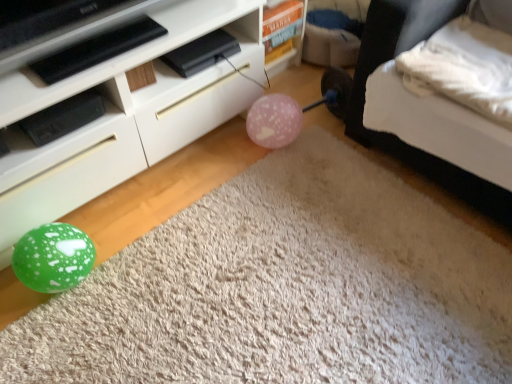
The image size is (512, 384). What do you see at coordinates (394, 135) in the screenshot?
I see `white soft bed at lower right` at bounding box center [394, 135].

Measure the distance between white soft pillow at upper right and camera.

white soft pillow at upper right and camera are 1.22 meters apart.

This screenshot has height=384, width=512. What are the coordinates of `pink matte balloon at center` in the screenshot? It's located at (274, 121).

This screenshot has width=512, height=384. I want to click on white soft bed at lower right, so click(x=394, y=135).

From a real-world perspective, between pink matte balloon at center and white soft pillow at upper right, who is vertically lower?

pink matte balloon at center is physically lower.

Identify the location of balloon behind the white soft pillow at upper right. (274, 121).

Is pink matte balloon at center positioned beyond the bounds of white soft pillow at upper right?

pink matte balloon at center is positioned outside white soft pillow at upper right.

Based on their sizes in the image, would you say pink matte balloon at center is bigger or smaller than white soft pillow at upper right?

In the image, pink matte balloon at center appears to be smaller than white soft pillow at upper right.

Which of these two, green glossy balloon at lower left or white glossy cabinet at lower left, stands taller?

Standing taller between the two is white glossy cabinet at lower left.

From a real-world perspective, which is physically below, green glossy balloon at lower left or white glossy cabinet at lower left?

green glossy balloon at lower left is physically lower.

Find the location of a particular element. This screenshot has width=512, height=384. furniture behind the green glossy balloon at lower left is located at coordinates (123, 116).

Is green glossy balloon at lower left oriented towards white glossy cabinet at lower left?

No, green glossy balloon at lower left does not turn towards white glossy cabinet at lower left.

From the image's perspective, between white soft bed at lower right and white soft pillow at upper right, who is located below?

white soft pillow at upper right, from the image's perspective.

Is white soft bed at lower right taller than white soft pillow at upper right?

Yes.

Which is more to the left, white soft bed at lower right or white soft pillow at upper right?

white soft pillow at upper right is more to the left.

Identify the location of pillow that is behind the green glossy balloon at lower left. The width and height of the screenshot is (512, 384). (464, 68).

From the image's perspective, is green glossy balloon at lower left located beneath white soft pillow at upper right?

Indeed, from the image's perspective, green glossy balloon at lower left is shown beneath white soft pillow at upper right.

Is green glossy balloon at lower left at the left side of white soft pillow at upper right?

Yes.

Which point is more forward, [295,157] or [486,50]?

The point [486,50] is more forward.

Are white soft pillow at upper right and green glossy balloon at lower left making contact?

No, white soft pillow at upper right is not with green glossy balloon at lower left.

From the picture: Considering the relative sizes of white soft pillow at upper right and green glossy balloon at lower left in the image provided, is white soft pillow at upper right shorter than green glossy balloon at lower left?

No, white soft pillow at upper right is not shorter than green glossy balloon at lower left.

Is white soft pillow at upper right at the left side of green glossy balloon at lower left?

No, white soft pillow at upper right is not to the left of green glossy balloon at lower left.

Considering the relative positions of white soft pillow at upper right and green glossy balloon at lower left in the image provided, is white soft pillow at upper right behind green glossy balloon at lower left?

Yes, white soft pillow at upper right is behind green glossy balloon at lower left.

Which of these two, white soft pillow at upper right or white soft bed at lower right, is smaller?

white soft pillow at upper right.

Between white soft pillow at upper right and white soft bed at lower right, which one has more height?

white soft bed at lower right.

Is white soft pillow at upper right further to camera compared to white soft bed at lower right?

That is True.

Which is closer, (449, 60) or (386, 20)?

Point (449, 60)

Which is behind, point (436, 355) or point (288, 100)?

The point (288, 100) is behind.

Considering the positions of objects green glossy balloon at lower left and pink matte balloon at center in the image provided, who is in front, green glossy balloon at lower left or pink matte balloon at center?

Positioned in front is green glossy balloon at lower left.

Is green glossy balloon at lower left shorter than pink matte balloon at center?

Correct, green glossy balloon at lower left is not as tall as pink matte balloon at center.

From a real-world perspective, between green glossy balloon at lower left and pink matte balloon at center, who is vertically higher?

In real-world perspective, pink matte balloon at center is above.

Locate an element on the screen. pillow in front of the pink matte balloon at center is located at coordinates (464, 68).

Where is `plain located on the right of white glossy cabinet at lower left`? The width and height of the screenshot is (512, 384). plain located on the right of white glossy cabinet at lower left is located at coordinates [x=285, y=289].

From the image, which object appears to be nearer to white soft pillow at upper right, white glossy cabinet at lower left or white soft bed at lower right?

Among the two, white soft bed at lower right is located nearer to white soft pillow at upper right.

Based on the photo, when comparing their distances from green glossy balloon at lower left, does white soft pillow at upper right or white soft bed at lower right seem closer?

Among the two, white soft bed at lower right is located nearer to green glossy balloon at lower left.

Considering their positions, is white soft bed at lower right positioned closer to white glossy cabinet at lower left than green glossy balloon at lower left?

green glossy balloon at lower left is closer to white glossy cabinet at lower left.

Based on their spatial positions, is green glossy balloon at lower left or white glossy cabinet at lower left further from white soft bed at lower right?

Among the two, white glossy cabinet at lower left is located further to white soft bed at lower right.

Looking at the image, which one is located further to white soft pillow at upper right, white soft bed at lower right or pink matte balloon at center?

pink matte balloon at center is further to white soft pillow at upper right.

From the image, which object appears to be nearer to white glossy cabinet at lower left, white soft bed at lower right or pink matte balloon at center?

Among the two, pink matte balloon at center is located nearer to white glossy cabinet at lower left.

Looking at the image, which one is located further to white glossy cabinet at lower left, white soft pillow at upper right or pink matte balloon at center?

white soft pillow at upper right is further to white glossy cabinet at lower left.

Estimate the real-world distances between objects in this image. Which object is closer to white glossy cabinet at lower left, pink matte balloon at center or green glossy balloon at lower left?

pink matte balloon at center.

The height and width of the screenshot is (384, 512). I want to click on pillow between white soft bed at lower right and green glossy balloon at lower left from top to bottom, so click(x=464, y=68).

This screenshot has height=384, width=512. I want to click on pillow situated between white glossy cabinet at lower left and white soft bed at lower right from left to right, so click(464, 68).

This screenshot has height=384, width=512. I want to click on plain between white glossy cabinet at lower left and white soft bed at lower right in the horizontal direction, so click(285, 289).

This screenshot has height=384, width=512. I want to click on plain located between pink matte balloon at center and white soft bed at lower right in the left-right direction, so click(x=285, y=289).